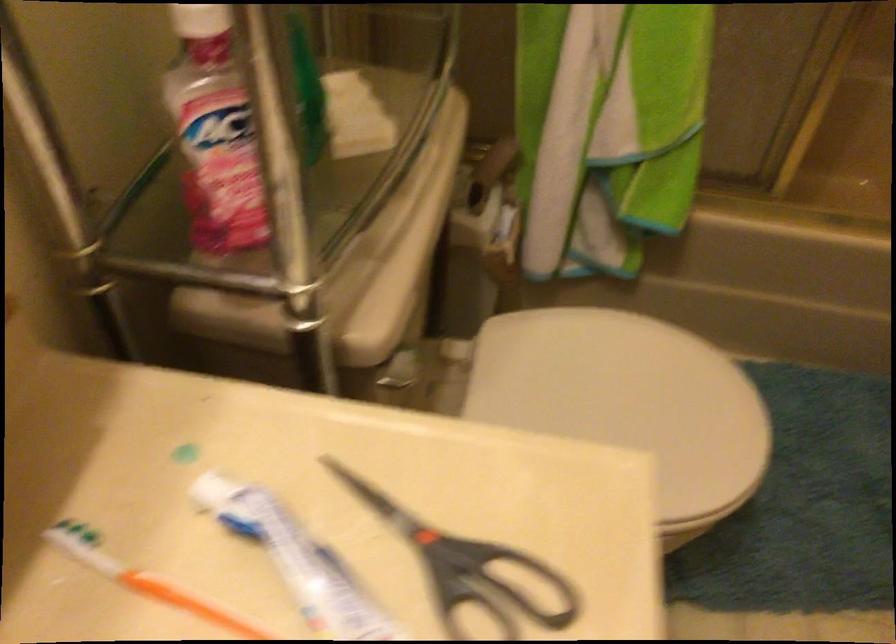
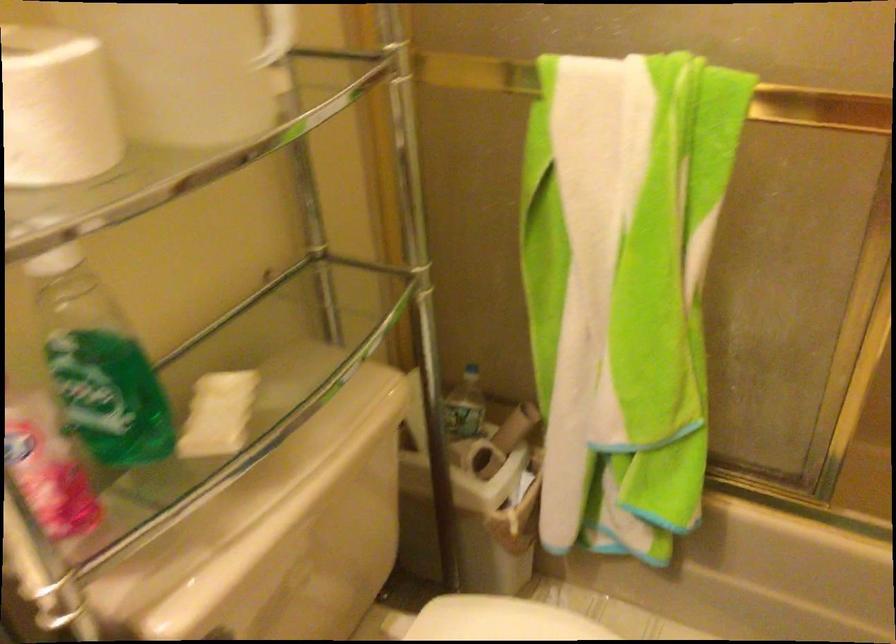
Question: What movement of the cameraman would produce the second image?

Choices:
 (A) Left
 (B) Right
 (C) Forward
 (D) Backward

Answer: (B)